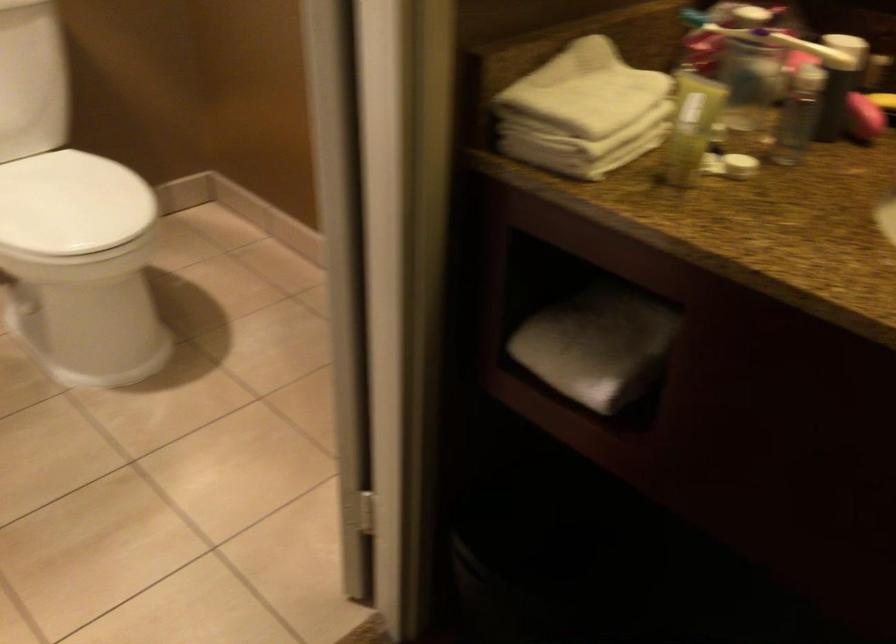
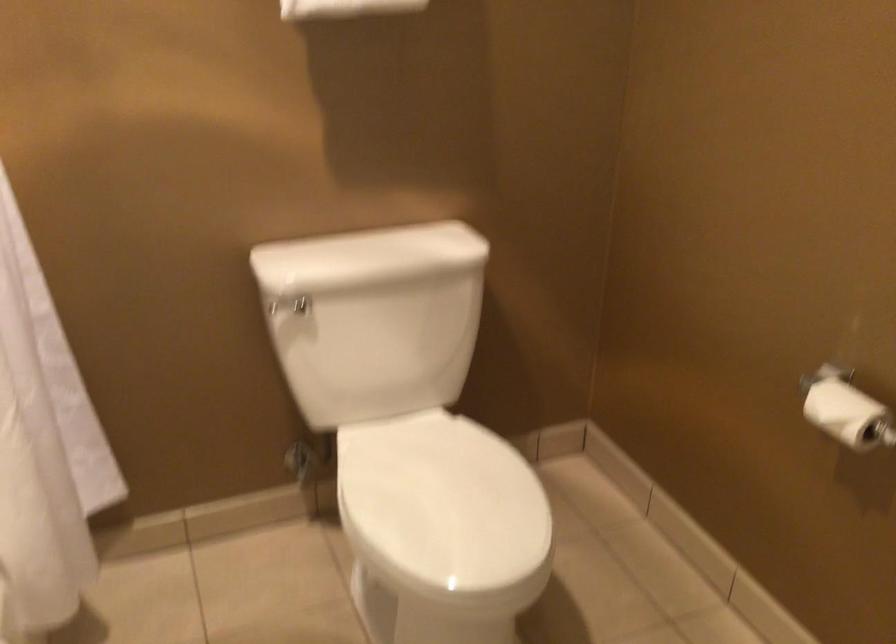
Question: The images are taken continuously from a first-person perspective. In which direction is your viewpoint rotating?

Choices:
 (A) Left
 (B) Right
 (C) Up
 (D) Down

Answer: (A)